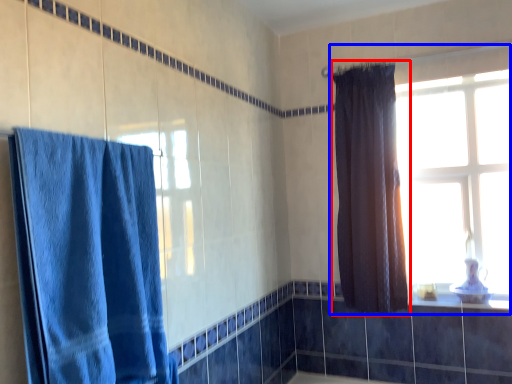
Question: Among these objects, which one is nearest to the camera, curtain (highlighted by a red box) or window (highlighted by a blue box)?

Choices:
 (A) curtain
 (B) window

Answer: (A)